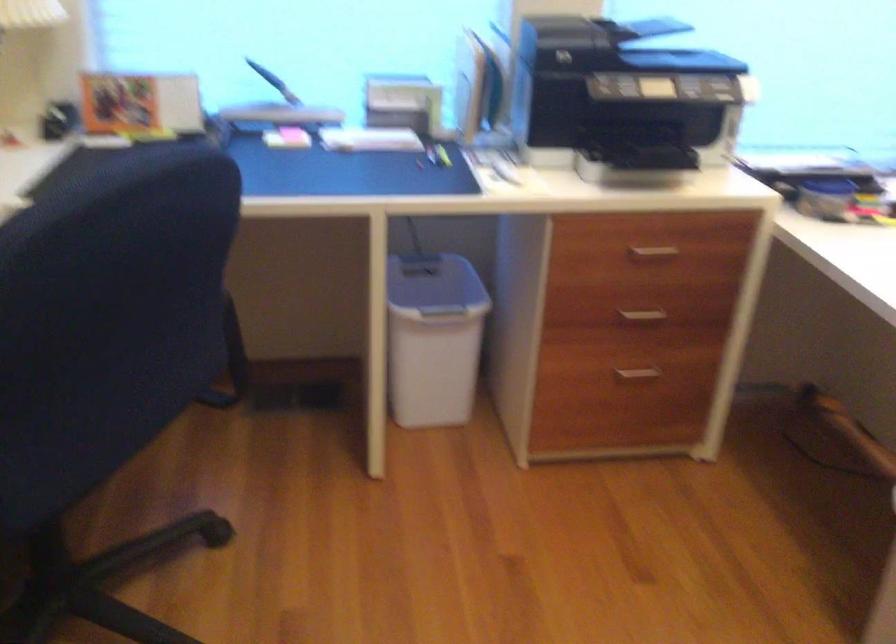
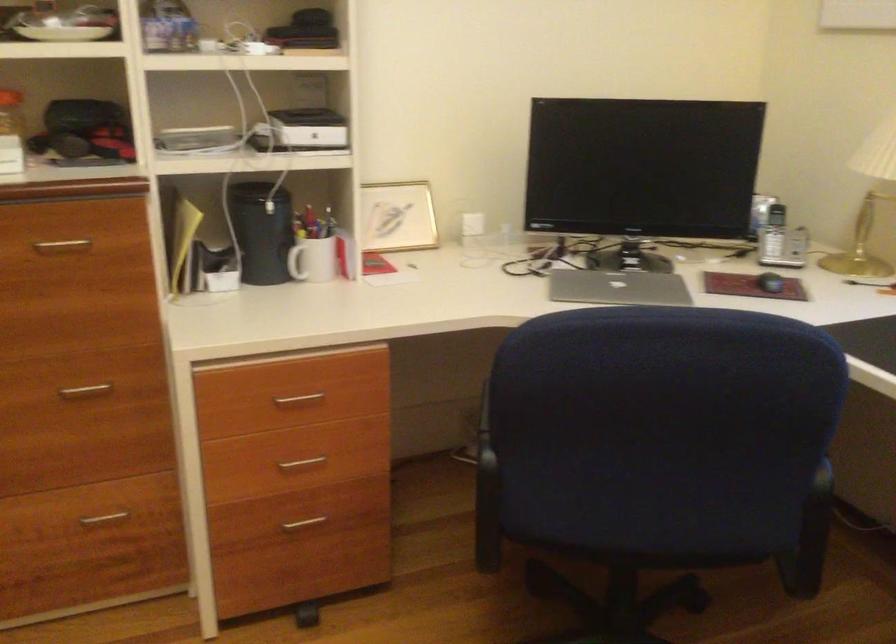
Question: The camera is either moving clockwise (left) or counter-clockwise (right) around the object. The first image is from the beginning of the video and the second image is from the end. Is the camera moving left or right when shooting the video?

Choices:
 (A) Left
 (B) Right

Answer: (B)